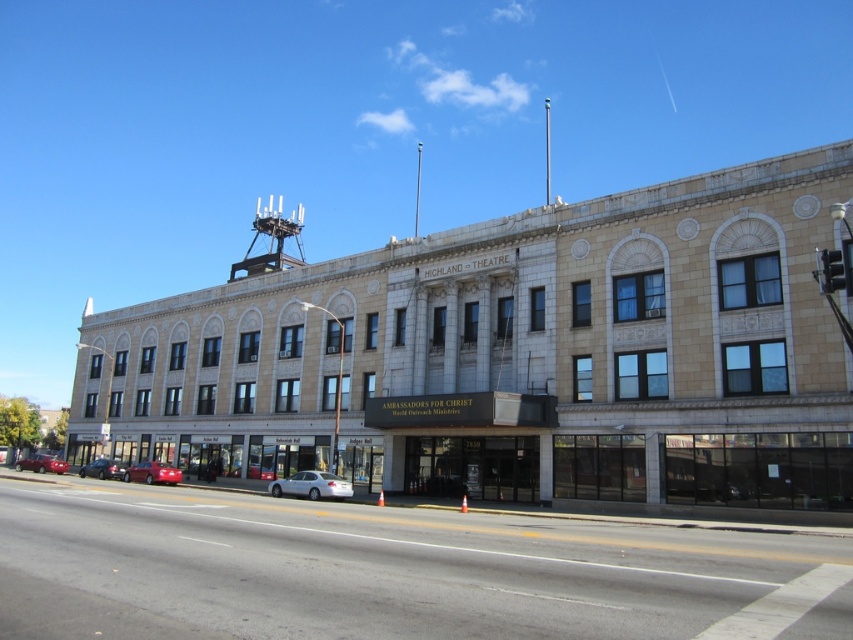
Question: Does silver metallic sedan at center have a lesser width compared to shiny black sedan at lower left?

Choices:
 (A) yes
 (B) no

Answer: (A)

Question: Which point is closer to the camera?

Choices:
 (A) silver metallic sedan at center
 (B) shiny black sedan at lower left
 (C) shiny red sedan at lower left
 (D) metallic red car at lower left

Answer: (A)

Question: Which of the following is the closest to the observer?

Choices:
 (A) shiny black sedan at lower left
 (B) silver metallic sedan at center
 (C) red glossy sedan at center
 (D) shiny red sedan at lower left

Answer: (B)

Question: Which point is farther to the camera?

Choices:
 (A) (141, 464)
 (B) (262, 468)
 (C) (25, 467)

Answer: (C)

Question: Does silver metallic sedan at center appear on the left side of metallic red car at lower left?

Choices:
 (A) no
 (B) yes

Answer: (A)

Question: In this image, where is silver metallic sedan at center located relative to shiny red sedan at lower left?

Choices:
 (A) right
 (B) left

Answer: (A)